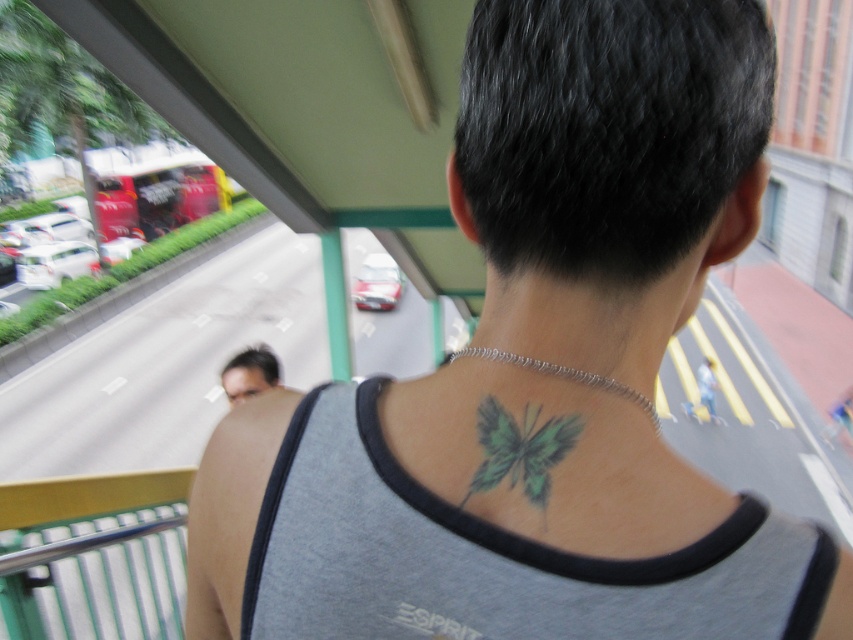
Between green matte butterfly at upper center and smooth skin face at center, which one appears on the left side from the viewer's perspective?

smooth skin face at center is more to the left.

The width and height of the screenshot is (853, 640). Describe the element at coordinates (520, 451) in the screenshot. I see `green matte butterfly at upper center` at that location.

Where is `green matte butterfly at upper center`? The image size is (853, 640). green matte butterfly at upper center is located at coordinates (520, 451).

Which of these two, green tattoo at center or green matte butterfly at upper center, stands taller?

green tattoo at center

From the picture: Is green tattoo at center closer to the viewer compared to green matte butterfly at upper center?

No, it is not.

Who is more distant from viewer, (647, 328) or (518, 433)?

The point (647, 328) is more distant.

The image size is (853, 640). What are the coordinates of `green tattoo at center` in the screenshot? It's located at (579, 356).

What do you see at coordinates (579, 356) in the screenshot? I see `green tattoo at center` at bounding box center [579, 356].

In the scene shown: Does green tattoo at center have a greater height compared to smooth skin face at center?

In fact, green tattoo at center may be shorter than smooth skin face at center.

Does point (601, 288) come in front of point (252, 387)?

That is True.

At what (x,y) coordinates should I click in order to perform the action: click on green tattoo at center. Please return your answer as a coordinate pair (x, y). Image resolution: width=853 pixels, height=640 pixels. Looking at the image, I should click on (579, 356).